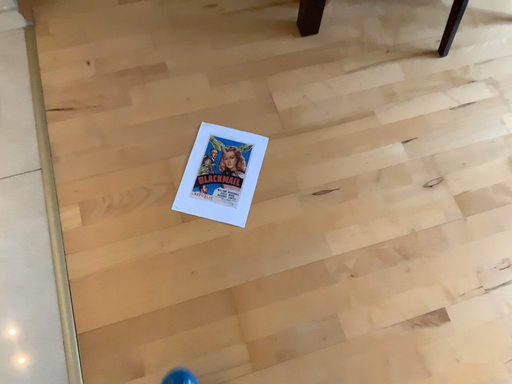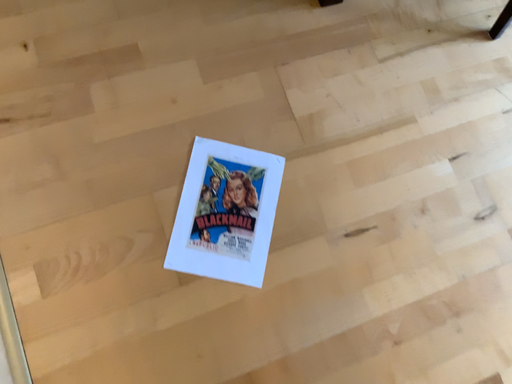
Question: How did the camera likely rotate when shooting the video?

Choices:
 (A) rotated downward
 (B) rotated upward

Answer: (A)